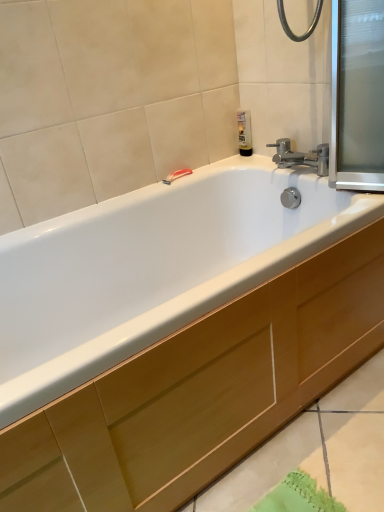
Question: Is transparent glass screen door at upper right outside wooden cabinet at lower center?

Choices:
 (A) yes
 (B) no

Answer: (A)

Question: From a real-world perspective, is transparent glass screen door at upper right located beneath wooden cabinet at lower center?

Choices:
 (A) no
 (B) yes

Answer: (A)

Question: Can you confirm if transparent glass screen door at upper right is taller than wooden cabinet at lower center?

Choices:
 (A) no
 (B) yes

Answer: (B)

Question: Is transparent glass screen door at upper right wider than wooden cabinet at lower center?

Choices:
 (A) no
 (B) yes

Answer: (A)

Question: Is transparent glass screen door at upper right beside wooden cabinet at lower center?

Choices:
 (A) no
 (B) yes

Answer: (A)

Question: Is translucent plastic soap dispenser at upper right taller or shorter than transparent glass screen door at upper right?

Choices:
 (A) tall
 (B) short

Answer: (B)

Question: From the image's perspective, is translucent plastic soap dispenser at upper right located above or below transparent glass screen door at upper right?

Choices:
 (A) below
 (B) above

Answer: (B)

Question: Is translucent plastic soap dispenser at upper right bigger or smaller than transparent glass screen door at upper right?

Choices:
 (A) big
 (B) small

Answer: (B)

Question: From a real-world perspective, is translucent plastic soap dispenser at upper right positioned above or below transparent glass screen door at upper right?

Choices:
 (A) above
 (B) below

Answer: (B)

Question: In terms of size, does red plastic towel bar at upper center appear bigger or smaller than translucent plastic soap dispenser at upper right?

Choices:
 (A) small
 (B) big

Answer: (A)

Question: Is red plastic towel bar at upper center to the left or to the right of translucent plastic soap dispenser at upper right in the image?

Choices:
 (A) left
 (B) right

Answer: (A)

Question: Considering the positions of point (168, 175) and point (248, 116), is point (168, 175) closer or farther from the camera than point (248, 116)?

Choices:
 (A) closer
 (B) farther

Answer: (A)

Question: Is red plastic towel bar at upper center taller or shorter than translucent plastic soap dispenser at upper right?

Choices:
 (A) tall
 (B) short

Answer: (B)

Question: In the image, is wooden cabinet at lower center on the left side or the right side of translucent plastic soap dispenser at upper right?

Choices:
 (A) left
 (B) right

Answer: (B)

Question: Is wooden cabinet at lower center taller or shorter than translucent plastic soap dispenser at upper right?

Choices:
 (A) tall
 (B) short

Answer: (B)